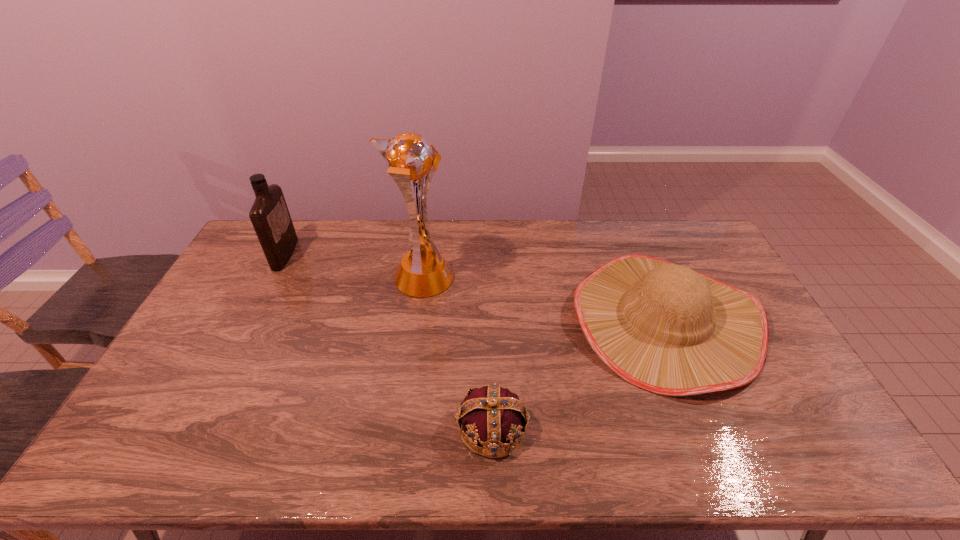
This screenshot has width=960, height=540. I want to click on vacant space at the near left corner, so click(155, 451).

The width and height of the screenshot is (960, 540). Identify the location of vacant area at the far right corner of the desktop. (684, 236).

Where is `free space between the sunhat and the second tallest object`? The width and height of the screenshot is (960, 540). free space between the sunhat and the second tallest object is located at coordinates (475, 287).

Where is `free area in between the second tallest object and the tallest object`? This screenshot has width=960, height=540. free area in between the second tallest object and the tallest object is located at coordinates click(353, 266).

Identify the location of vacant point located between the second tallest object and the trophy. This screenshot has height=540, width=960. [353, 266].

You are a GUI agent. You are given a task and a screenshot of the screen. Output one action in this format:
    pyautogui.click(x=<x>, y=<y>)
    Task: Click on the free space between the crown and the second object from left to right
    The image size is (960, 540).
    Given the screenshot: What is the action you would take?
    pyautogui.click(x=457, y=353)

Identify the location of vacant space in between the leftmost object and the rightmost object. Image resolution: width=960 pixels, height=540 pixels. click(475, 287).

You are a GUI agent. You are given a task and a screenshot of the screen. Output one action in this format:
    pyautogui.click(x=<x>, y=<y>)
    Task: Click on the free spot between the trophy and the rightmost object
    
    Given the screenshot: What is the action you would take?
    pyautogui.click(x=543, y=300)

Locate an element on the screen. This screenshot has width=960, height=540. free space between the second object from left to right and the shortest object is located at coordinates (457, 353).

Where is `vacant space in between the tallest object and the leftmost object`? vacant space in between the tallest object and the leftmost object is located at coordinates (353, 266).